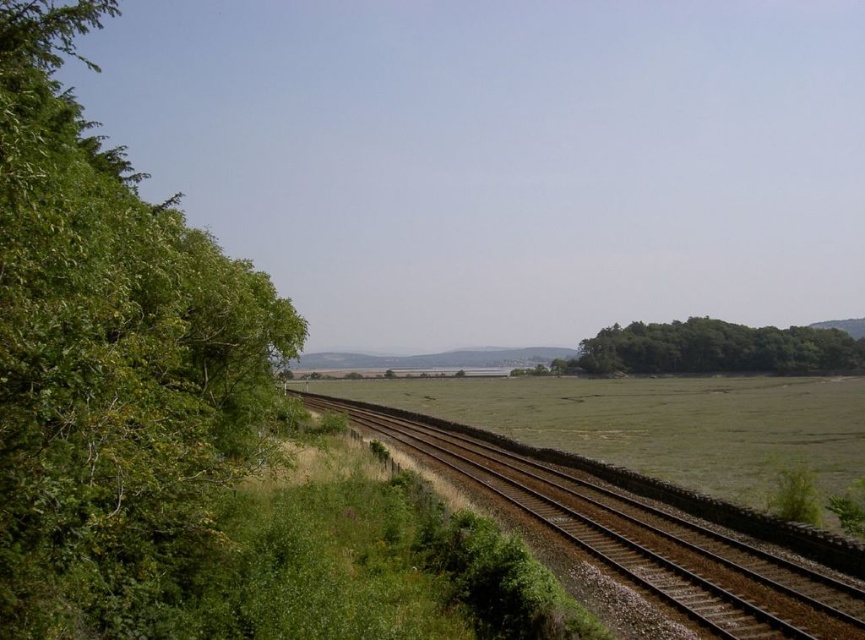
Which is below, brown gravel track at center or green leafy trees at right?

Positioned lower is brown gravel track at center.

Is point (588, 500) more distant than point (682, 337)?

No, (588, 500) is closer to viewer.

This screenshot has height=640, width=865. What are the coordinates of `brown gravel track at center` in the screenshot? It's located at (642, 532).

Who is more distant from viewer, [36,493] or [660,522]?

The point [660,522] is more distant.

Does green leafy tree at left appear under brown gravel track at center?

No, green leafy tree at left is not below brown gravel track at center.

Is point (163, 410) in front of point (472, 428)?

That is True.

Image resolution: width=865 pixels, height=640 pixels. I want to click on green leafy tree at left, so click(107, 342).

Does green leafy tree at left have a lesser width compared to green leafy trees at right?

Indeed, green leafy tree at left has a lesser width compared to green leafy trees at right.

Between green leafy tree at left and green leafy trees at right, which one is positioned higher?

Positioned higher is green leafy tree at left.

Who is more forward, (x=3, y=520) or (x=644, y=362)?

Positioned in front is point (x=3, y=520).

Image resolution: width=865 pixels, height=640 pixels. I want to click on green leafy tree at left, so click(x=107, y=342).